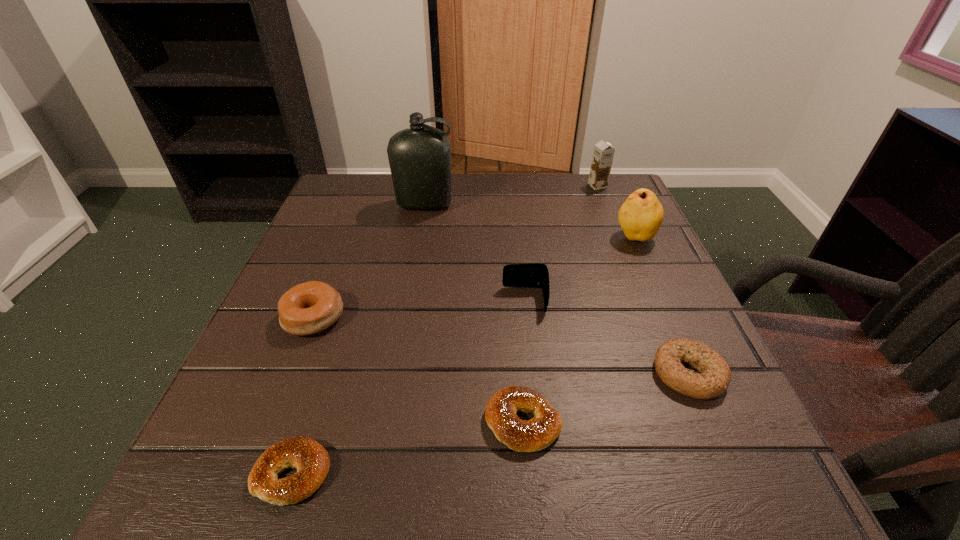
Locate an element on the screen. the seventh nearest object is located at coordinates (419, 157).

This screenshot has width=960, height=540. I want to click on the tallest object, so click(x=419, y=157).

At what (x,y) coordinates should I click in order to perform the action: click on the farthest object. Please return your answer as a coordinate pair (x, y). The image size is (960, 540). Looking at the image, I should click on (603, 153).

Where is `pear`? pear is located at coordinates (641, 215).

Where is `wallet`? The image size is (960, 540). wallet is located at coordinates (534, 274).

Identify the location of the fourth shortest object. This screenshot has height=540, width=960. (308, 308).

Where is `the tallest bagel`? The width and height of the screenshot is (960, 540). the tallest bagel is located at coordinates (308, 308).

Locate an element on the screen. The width and height of the screenshot is (960, 540). the rightmost bagel is located at coordinates (715, 376).

The width and height of the screenshot is (960, 540). Find the location of `the third bagel from left to right`. the third bagel from left to right is located at coordinates pos(533,435).

Identify the location of free space located 0.170m on the left of the bottle. Image resolution: width=960 pixels, height=540 pixels. (327, 205).